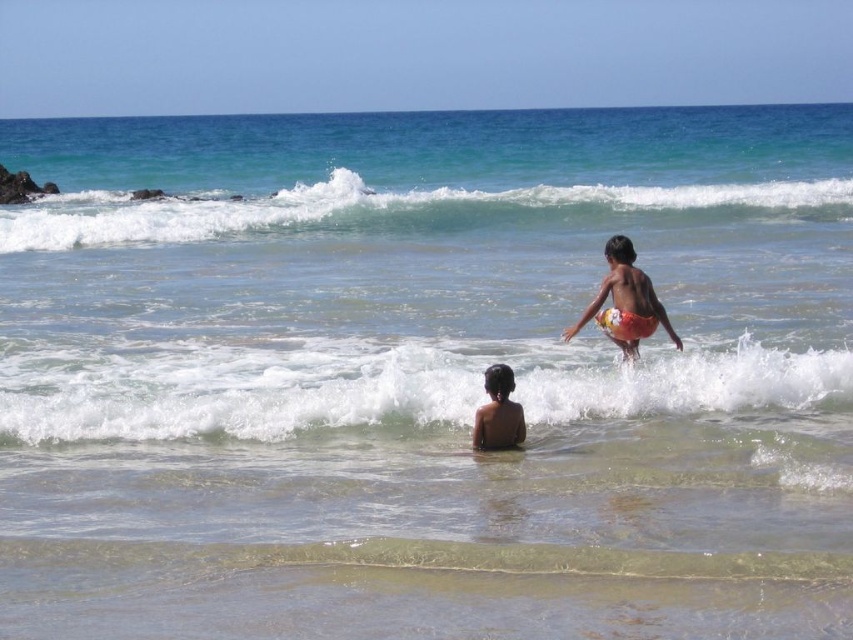
Is point (283, 364) in front of point (233, 216)?

Yes, it is in front of point (233, 216).

Does white frothy wave at center have a smaller size compared to greenish-blue foam at upper center?

Correct, white frothy wave at center occupies less space than greenish-blue foam at upper center.

Describe the element at coordinates (401, 388) in the screenshot. I see `white frothy wave at center` at that location.

The height and width of the screenshot is (640, 853). Find the location of `white frothy wave at center`. white frothy wave at center is located at coordinates (401, 388).

Between greenish-blue foam at upper center and brown skin at lower center, which one has less height?

Standing shorter between the two is brown skin at lower center.

Who is lower down, greenish-blue foam at upper center or brown skin at lower center?

Positioned lower is brown skin at lower center.

The height and width of the screenshot is (640, 853). I want to click on greenish-blue foam at upper center, so click(x=410, y=211).

Locate an element on the screen. The width and height of the screenshot is (853, 640). greenish-blue foam at upper center is located at coordinates (410, 211).

Which is more to the left, white frothy wave at center or brown skin at lower center?

white frothy wave at center

Who is taller, white frothy wave at center or brown skin at lower center?

white frothy wave at center is taller.

What do you see at coordinates (401, 388) in the screenshot? I see `white frothy wave at center` at bounding box center [401, 388].

Locate an element on the screen. white frothy wave at center is located at coordinates (401, 388).